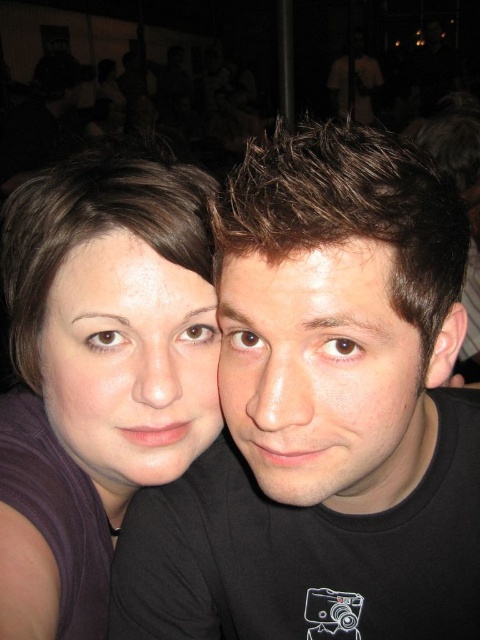
You are at a party and want to take a photo of both the black matte shirt at center and the matte brown hair at center. Which object should you focus on first to ensure both are in frame?

The black matte shirt at center is much taller than the matte brown hair at center, so you should focus on the black matte shirt at center first to ensure both are in frame.

Based on the photo, you are standing at the point marked as point (253,275) in the image. You want to give a high five to someone who is exactly 15 inches away from you. Can you reach them?

The distance between you and the viewer is 16.71 inches, which is more than 15 inches. Therefore, you cannot reach them for a high five.

You are a photographer at a social event and need to capture a clear portrait of the smooth skin face at center and the matte brown hair at center. Since the background is busy, you want to ensure that the two subjects are separated enough in the frame. Which subject should you position closer to the camera to create more separation between them?

To create more separation between the smooth skin face at center and the matte brown hair at center, you should position the smooth skin face at center closer to the camera. This is because the smooth skin face at center is already on the right side of the matte brown hair at center, so moving it forward will increase the distance between them in the frame.